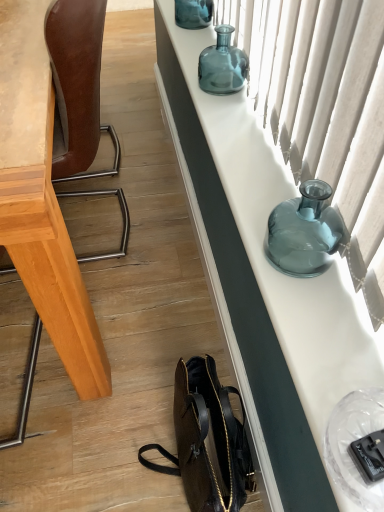
Question: Does translucent fabric curtain at upper right have a larger size compared to translucent glass vase at upper center, the second bottle when ordered from bottom to top?

Choices:
 (A) no
 (B) yes

Answer: (B)

Question: From the image's perspective, is translucent fabric curtain at upper right over translucent glass vase at upper center, the second bottle when ordered from bottom to top?

Choices:
 (A) no
 (B) yes

Answer: (A)

Question: From the image's perspective, is translucent fabric curtain at upper right located beneath translucent glass vase at upper center, the second bottle when ordered from bottom to top?

Choices:
 (A) yes
 (B) no

Answer: (A)

Question: From a real-world perspective, is translucent fabric curtain at upper right below translucent glass vase at upper center, the second bottle viewed from the front?

Choices:
 (A) yes
 (B) no

Answer: (B)

Question: Is translucent fabric curtain at upper right to the left of translucent glass vase at upper center, the second bottle in the back-to-front sequence, from the viewer's perspective?

Choices:
 (A) no
 (B) yes

Answer: (A)

Question: Does translucent fabric curtain at upper right turn towards translucent glass vase at upper center, the second bottle in the back-to-front sequence?

Choices:
 (A) no
 (B) yes

Answer: (B)

Question: Does brown leather handbag at lower center appear on the left side of translucent glass vase at upper center, the second bottle viewed from the front?

Choices:
 (A) yes
 (B) no

Answer: (A)

Question: Does brown leather handbag at lower center turn towards translucent glass vase at upper center, which ranks as the 2th bottle in top-to-bottom order?

Choices:
 (A) yes
 (B) no

Answer: (B)

Question: Does brown leather handbag at lower center come behind translucent glass vase at upper center, the second bottle in the back-to-front sequence?

Choices:
 (A) no
 (B) yes

Answer: (A)

Question: Is brown leather handbag at lower center outside of translucent glass vase at upper center, which ranks as the 2th bottle in top-to-bottom order?

Choices:
 (A) no
 (B) yes

Answer: (B)

Question: From the image's perspective, is brown leather handbag at lower center located beneath translucent glass vase at upper center, the second bottle viewed from the front?

Choices:
 (A) no
 (B) yes

Answer: (B)

Question: Can you confirm if brown leather handbag at lower center is taller than translucent glass vase at upper center, the second bottle when ordered from bottom to top?

Choices:
 (A) no
 (B) yes

Answer: (B)

Question: Is brown leather chair at left far away from translucent glass vase at upper center, the second bottle in the back-to-front sequence?

Choices:
 (A) no
 (B) yes

Answer: (A)